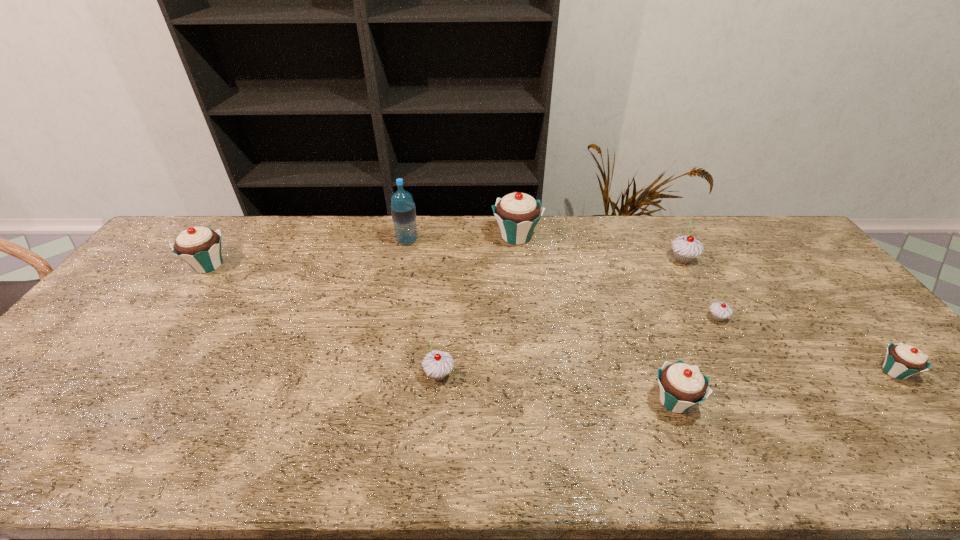
Where is `the closest object relative to the second cupcake from left to right`? The width and height of the screenshot is (960, 540). the closest object relative to the second cupcake from left to right is located at coordinates (682, 386).

Locate an element on the screen. object identified as the second closest to the rightmost cupcake is located at coordinates (685, 249).

Locate an element on the screen. The height and width of the screenshot is (540, 960). cupcake that is the closest to the leftmost gray cupcake is located at coordinates (682, 386).

Where is `cupcake that is the fifth closest to the smallest gray cupcake`? cupcake that is the fifth closest to the smallest gray cupcake is located at coordinates (437, 364).

Identify which teal cupcake is the closest to the third cupcake from left to right. Please provide its 2D coordinates. Your answer should be formatted as a tuple, i.e. [(x, y)], where the tuple contains the x and y coordinates of a point satisfying the conditions above.

[(682, 386)]

Locate an element on the screen. teal cupcake that is the closest one to the third biggest teal cupcake is located at coordinates (902, 361).

I want to click on gray cupcake that is the second closest one to the second nearest gray cupcake, so click(437, 364).

Point out which gray cupcake is positioned as the second nearest to the second teal cupcake from left to right. Please provide its 2D coordinates. Your answer should be formatted as a tuple, i.e. [(x, y)], where the tuple contains the x and y coordinates of a point satisfying the conditions above.

[(437, 364)]

You are a GUI agent. You are given a task and a screenshot of the screen. Output one action in this format:
    pyautogui.click(x=<x>, y=<y>)
    Task: Click on the vacant space that satisfies the following two spatial constraints: 1. on the front side of the leftmost gray cupcake; 2. on the right side of the blue water bottle
    This screenshot has height=540, width=960.
    Given the screenshot: What is the action you would take?
    pyautogui.click(x=379, y=374)

The image size is (960, 540). What are the coordinates of `vacant space that satisfies the following two spatial constraints: 1. on the front side of the smallest teal cupcake; 2. on the left side of the blue water bottle` in the screenshot? It's located at (380, 372).